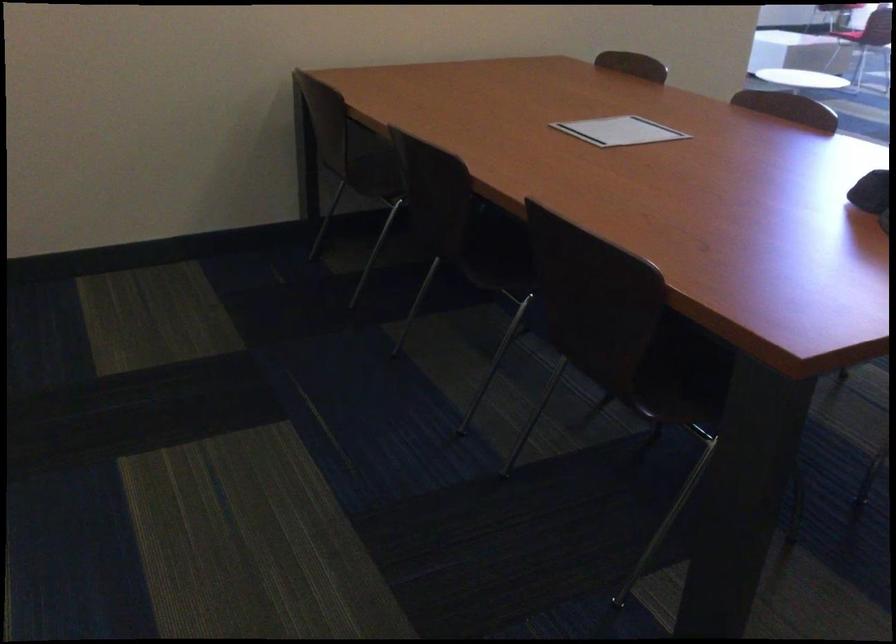
How did the camera likely rotate?

The camera rotated toward right-down.